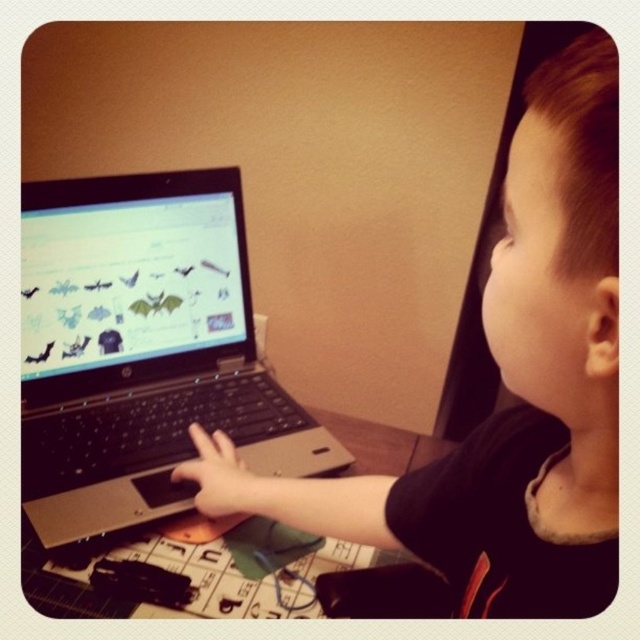
The child is trying to place their hand on the laptop keyboard. Based on the sizes of the black matte laptop at left and the matte black hand at center, will the hand fit entirely on the keyboard without overlapping the edges?

The black matte laptop at left is wider than the matte black hand at center, so the hand should fit entirely on the keyboard without overlapping the edges.

Where is the black matte laptop at left located on the desk?

The black matte laptop at left is located at point (524, 381) on the desk.